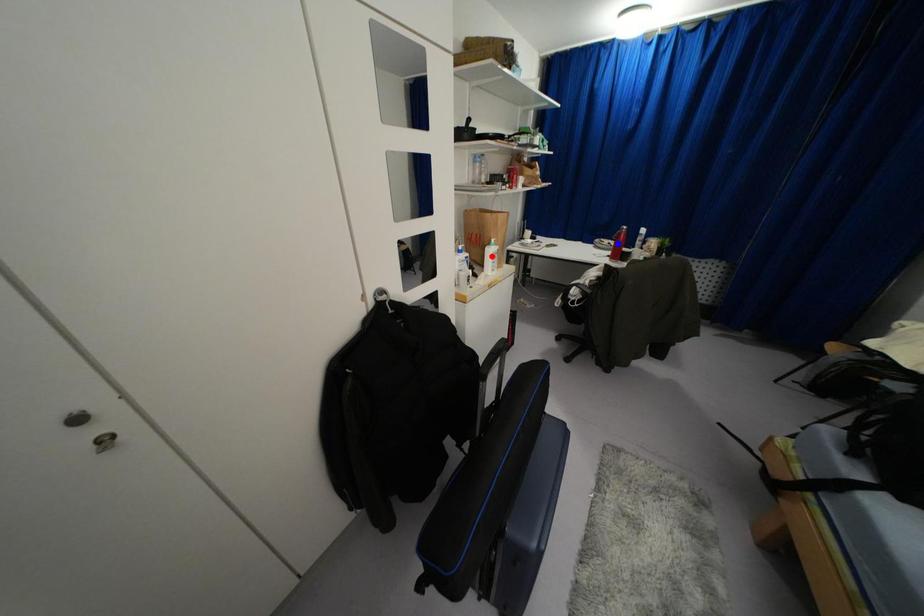
Question: Two points are marked on the image. Which point is closer to the camera?

Choices:
 (A) Blue point is closer.
 (B) Red point is closer.

Answer: (B)